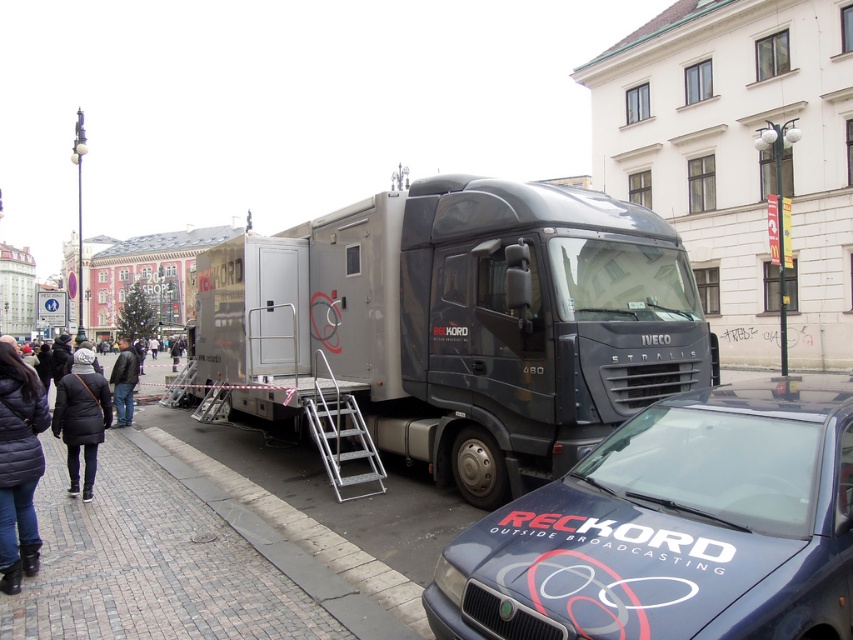
Question: Among these objects, which one is nearest to the camera?

Choices:
 (A) leather jacket at lower left
 (B) metallic silver trailer truck at center

Answer: (B)

Question: Is matte black van at center bigger than leather jacket at lower left?

Choices:
 (A) no
 (B) yes

Answer: (A)

Question: Which object is the farthest from the metallic silver ladder at center?

Choices:
 (A) dark blue quilted jacket at lower left
 (B) black matte jacket at lower left
 (C) matte black van at center
 (D) metallic silver trailer truck at center

Answer: (C)

Question: Is metallic silver trailer truck at center to the left of leather jacket at lower left from the viewer's perspective?

Choices:
 (A) yes
 (B) no

Answer: (B)

Question: Which of these objects is positioned closest to the black matte jacket at lower left?

Choices:
 (A) leather jacket at lower left
 (B) metallic silver ladder at center
 (C) matte black van at center

Answer: (B)

Question: Is the position of matte black van at center less distant than that of metallic silver ladder at center?

Choices:
 (A) yes
 (B) no

Answer: (A)